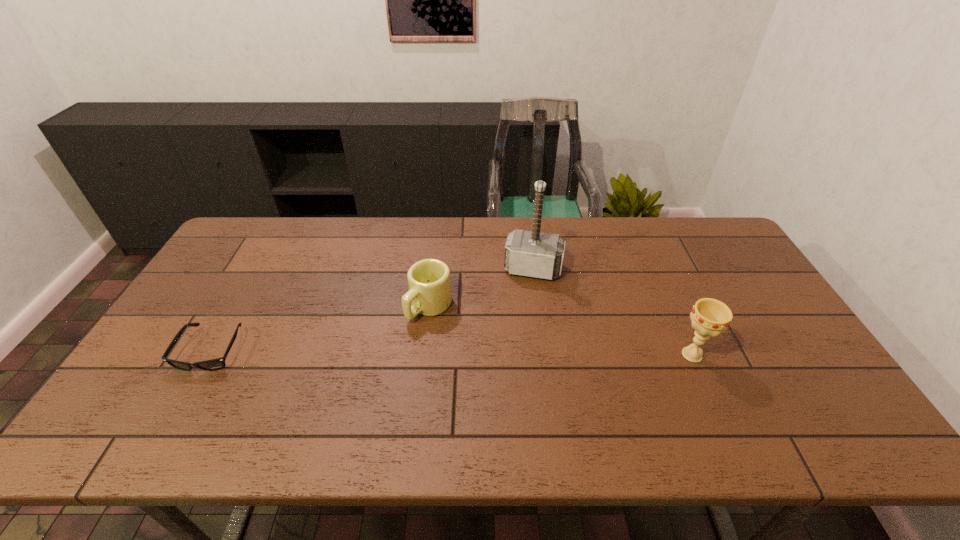
Locate an element on the screen. Image resolution: width=960 pixels, height=540 pixels. vacant space that is in between the third tallest object and the third object from left to right is located at coordinates (481, 288).

Identify the location of vacant space that is in between the rightmost object and the mug. (561, 330).

At what (x,y) coordinates should I click in order to perform the action: click on vacant region between the shortest object and the second shortest object. Please return your answer as a coordinate pair (x, y). The width and height of the screenshot is (960, 540). Looking at the image, I should click on (321, 328).

Point out which object is positioned as the third nearest to the farthest object. Please provide its 2D coordinates. Your answer should be formatted as a tuple, i.e. [(x, y)], where the tuple contains the x and y coordinates of a point satisfying the conditions above.

[(214, 364)]

Where is `object that ranks as the third closest to the chalice`? The height and width of the screenshot is (540, 960). object that ranks as the third closest to the chalice is located at coordinates (214, 364).

This screenshot has width=960, height=540. I want to click on vacant space that satisfies the following two spatial constraints: 1. on the back side of the mug; 2. on the left side of the tallest object, so click(434, 269).

What are the coordinates of `free space that satisfies the following two spatial constraints: 1. on the front side of the third shortest object; 2. on the left side of the hammer` in the screenshot? It's located at (544, 355).

The image size is (960, 540). Identify the location of blank space that satisfies the following two spatial constraints: 1. on the front-facing side of the leftmost object; 2. on the right side of the third shortest object. (209, 355).

Where is `vacant area that satisfies the following two spatial constraints: 1. on the front-facing side of the leftmost object; 2. on the right side of the second tallest object`? This screenshot has height=540, width=960. vacant area that satisfies the following two spatial constraints: 1. on the front-facing side of the leftmost object; 2. on the right side of the second tallest object is located at coordinates (209, 355).

The image size is (960, 540). Find the location of `vacant position in the image that satisfies the following two spatial constraints: 1. on the front-facing side of the sunglasses; 2. on the right side of the rightmost object`. vacant position in the image that satisfies the following two spatial constraints: 1. on the front-facing side of the sunglasses; 2. on the right side of the rightmost object is located at coordinates (209, 355).